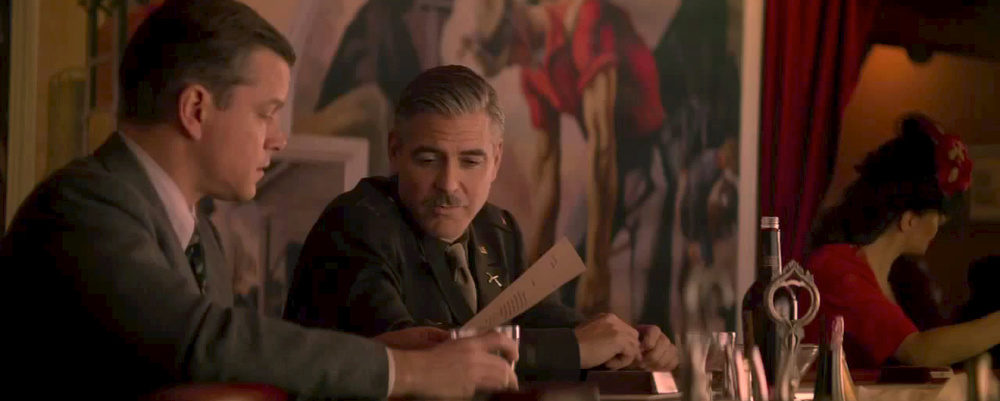
At what (x,y) coordinates should I click in order to perform the action: click on painting mural. Please return your answer as a coordinate pair (x, y). Image resolution: width=1000 pixels, height=401 pixels. Looking at the image, I should click on [x=608, y=100].